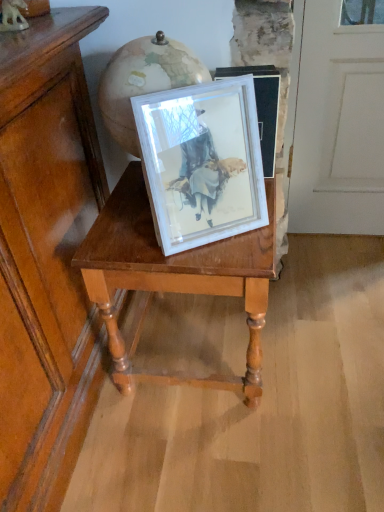
Image resolution: width=384 pixels, height=512 pixels. In order to click on free spot to the left of white matte picture frame at center in this screenshot , I will do pyautogui.click(x=120, y=240).